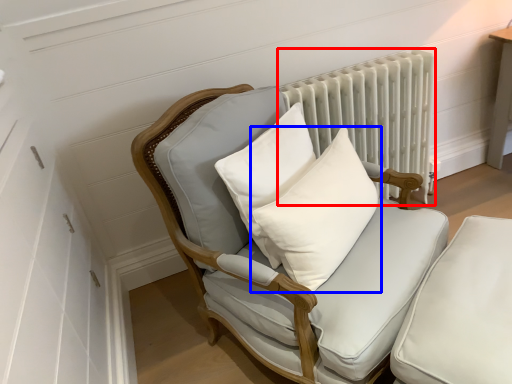
Question: Which of the following is the closest to the observer, radiator (highlighted by a red box) or pillow (highlighted by a blue box)?

Choices:
 (A) radiator
 (B) pillow

Answer: (B)